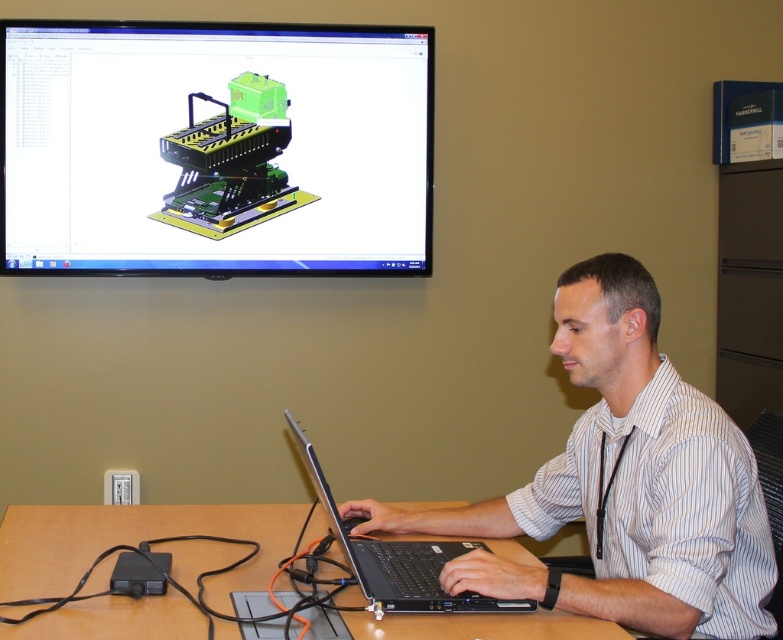
Question: Considering the real-world distances, which object is closest to the black matte laptop at center?

Choices:
 (A) white striped shirt at center
 (B) matte black monitor at upper center

Answer: (A)

Question: Which of the following is the farthest from the observer?

Choices:
 (A) matte black monitor at upper center
 (B) black matte laptop at center
 (C) white striped shirt at center
 (D) brown wooden table at center

Answer: (A)

Question: Considering the relative positions of matte black monitor at upper center and white striped shirt at center in the image provided, where is matte black monitor at upper center located with respect to white striped shirt at center?

Choices:
 (A) above
 (B) below

Answer: (A)

Question: Does white striped shirt at center appear under brown wooden table at center?

Choices:
 (A) no
 (B) yes

Answer: (A)

Question: Which of the following is the closest to the observer?

Choices:
 (A) brown wooden table at center
 (B) matte black monitor at upper center

Answer: (A)

Question: Is matte black monitor at upper center wider than white striped shirt at center?

Choices:
 (A) yes
 (B) no

Answer: (A)